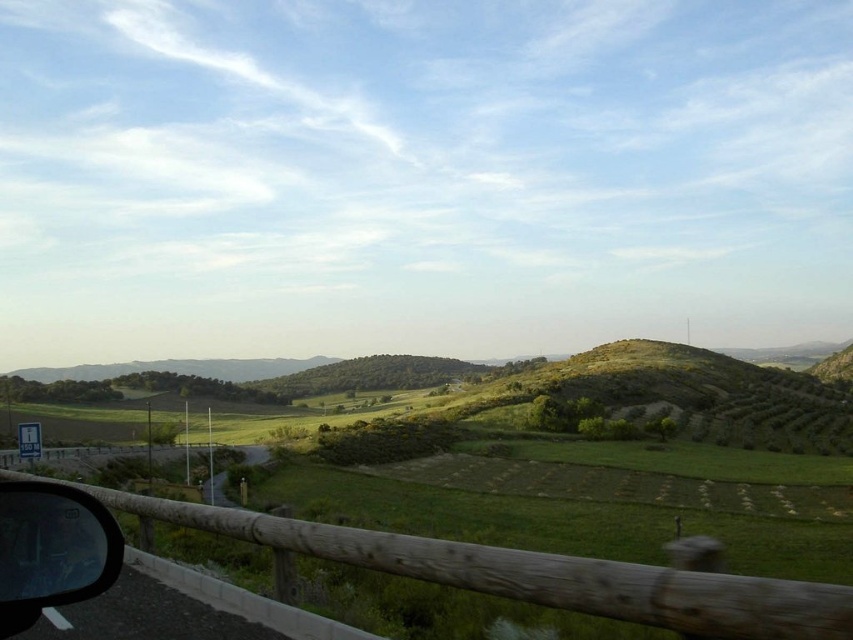
Can you confirm if wooden at lower center is wider than transparent glass car window at lower left?

Indeed, wooden at lower center has a greater width compared to transparent glass car window at lower left.

Measure the distance between point (525, 561) and camera.

The distance of point (525, 561) from camera is 3.59 meters.

Who is more distant from viewer, (x=724, y=620) or (x=62, y=534)?

The point (x=724, y=620) is more distant.

At what (x,y) coordinates should I click in order to perform the action: click on wooden at lower center. Please return your answer as a coordinate pair (x, y). This screenshot has height=640, width=853. Looking at the image, I should click on (532, 573).